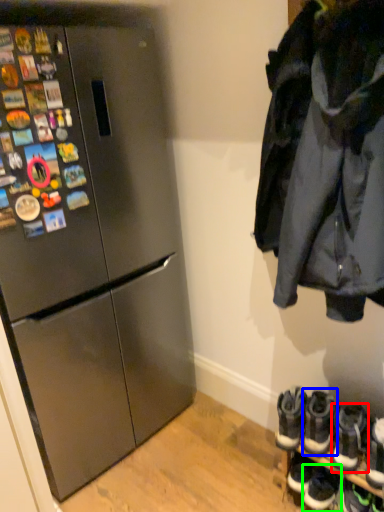
Question: Which object is the farthest from footwear (highlighted by a red box)? Choose among these: footwear (highlighted by a blue box) or footwear (highlighted by a green box).

Choices:
 (A) footwear
 (B) footwear

Answer: (B)